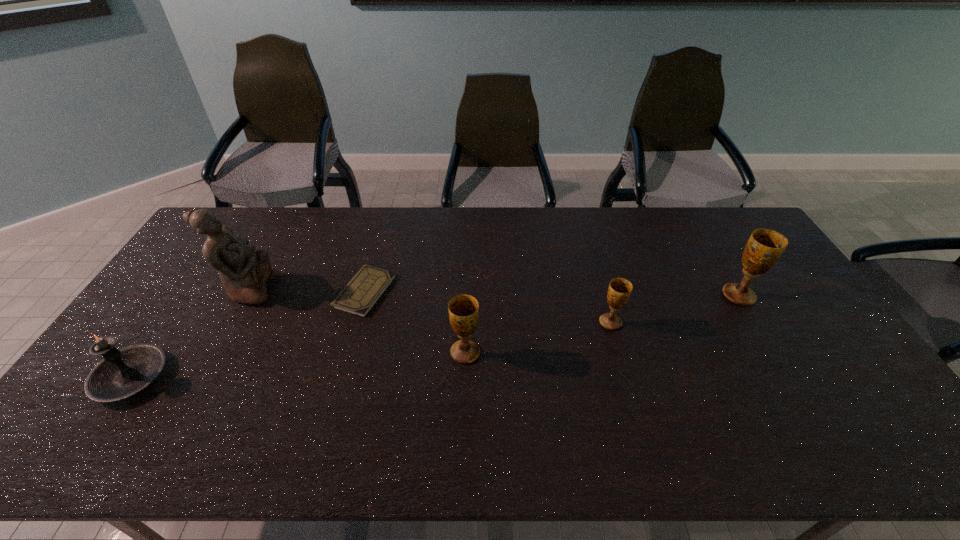
Where is `vacant place for an extra chalice on the left`? This screenshot has width=960, height=540. vacant place for an extra chalice on the left is located at coordinates (300, 387).